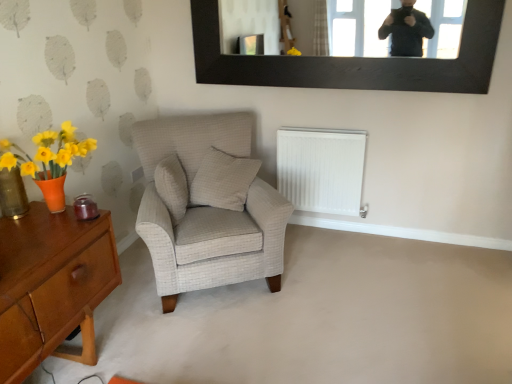
The height and width of the screenshot is (384, 512). I want to click on unoccupied region to the right of light gray fabric armchair at center, so click(339, 277).